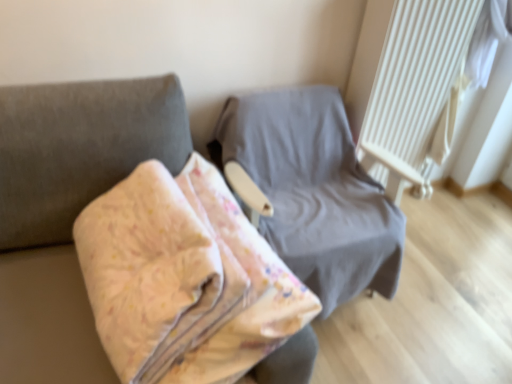
Question: Based on their positions, is white textured radiator at upper right located to the left or right of floral fabric blanket at center, the 1th furniture when ordered from front to back?

Choices:
 (A) right
 (B) left

Answer: (A)

Question: From the image's perspective, relative to floral fabric blanket at center, arranged as the second furniture when viewed from the back, is white textured radiator at upper right above or below?

Choices:
 (A) below
 (B) above

Answer: (B)

Question: Which of these objects is positioned farthest from the gray fabric chair at center, the 1th furniture in the back-to-front sequence?

Choices:
 (A) floral fabric blanket at center, the 1th furniture when ordered from front to back
 (B) white textured radiator at upper right

Answer: (A)

Question: Which is farther from the floral fabric blanket at center, arranged as the second furniture when viewed from the back?

Choices:
 (A) gray fabric chair at center, the 2th furniture from the front
 (B) white textured radiator at upper right

Answer: (B)